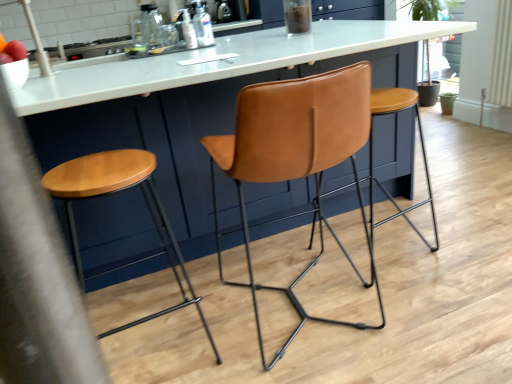
Where is `free space that is in between matte brown stool at center, which is the 2th stool in right-to-left order, and cognac leather chair at center`? Image resolution: width=512 pixels, height=384 pixels. free space that is in between matte brown stool at center, which is the 2th stool in right-to-left order, and cognac leather chair at center is located at coordinates (221, 324).